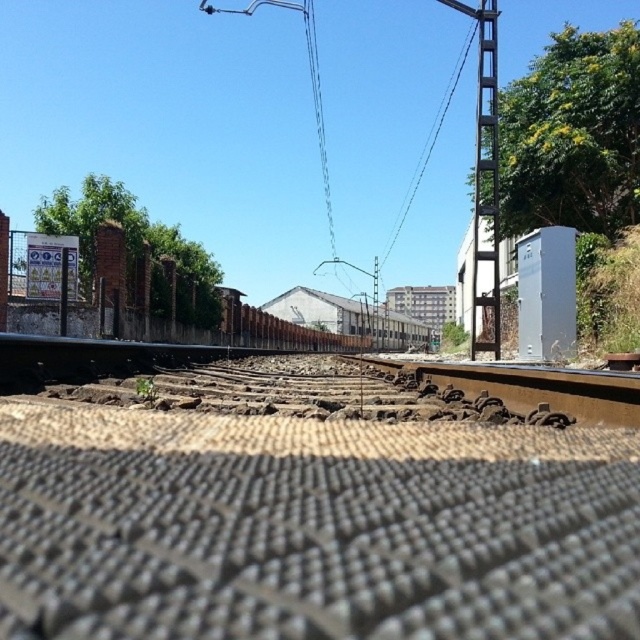
Question: Does gray textured gravel at center have a larger size compared to metallic gray train track at center?

Choices:
 (A) yes
 (B) no

Answer: (A)

Question: Considering the relative positions of gray textured gravel at center and metallic gray train track at center in the image provided, where is gray textured gravel at center located with respect to metallic gray train track at center?

Choices:
 (A) below
 (B) above

Answer: (B)

Question: Which point is closer to the camera?

Choices:
 (A) gray textured gravel at center
 (B) metallic gray train track at center

Answer: (A)

Question: Does gray textured gravel at center have a lesser width compared to metallic gray train track at center?

Choices:
 (A) no
 (B) yes

Answer: (A)